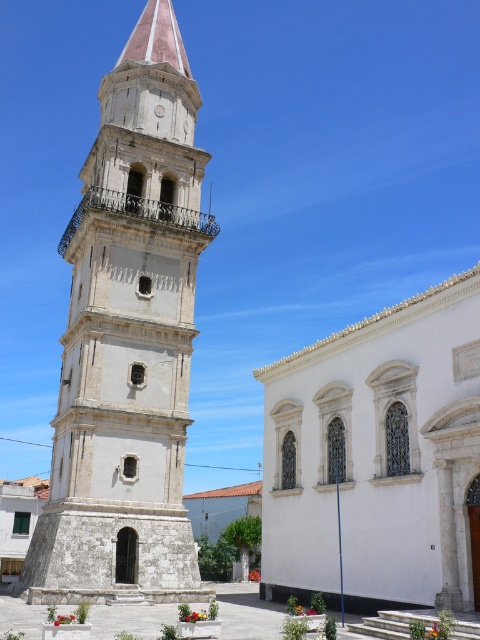
Question: Is white stone tower at center thinner than white stone church at center?

Choices:
 (A) yes
 (B) no

Answer: (B)

Question: Is white stone tower at center to the right of white stone church at center from the viewer's perspective?

Choices:
 (A) yes
 (B) no

Answer: (B)

Question: Which point is farther to the camera?

Choices:
 (A) white stone church at center
 (B) white stone tower at center

Answer: (B)

Question: Which point is farther from the camera taking this photo?

Choices:
 (A) (363, 570)
 (B) (172, 20)

Answer: (B)

Question: Does white stone tower at center have a smaller size compared to white stone church at center?

Choices:
 (A) yes
 (B) no

Answer: (B)